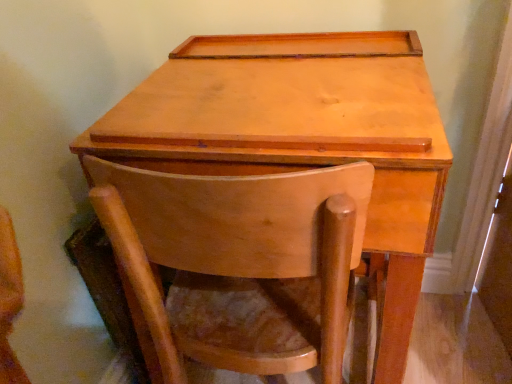
At what (x,y) coordinates should I click in order to perform the action: click on matte wood chair at center. Please return your answer as a coordinate pair (x, y). The width and height of the screenshot is (512, 384). Looking at the image, I should click on (239, 263).

Describe the element at coordinates (239, 263) in the screenshot. I see `matte wood chair at center` at that location.

This screenshot has height=384, width=512. What are the coordinates of `light brown wood table at center` in the screenshot? It's located at (303, 137).

The image size is (512, 384). What do you see at coordinates (303, 137) in the screenshot?
I see `light brown wood table at center` at bounding box center [303, 137].

Identify the location of matte wood chair at center. The image size is (512, 384). click(239, 263).

Which object is positioned more to the left, matte wood chair at center or light brown wood table at center?

From the viewer's perspective, matte wood chair at center appears more on the left side.

Is matte wood chair at center positioned in front of light brown wood table at center?

Yes, matte wood chair at center is closer to the camera.

Is point (145, 207) farther from viewer compared to point (395, 122)?

That is False.

From the image's perspective, is matte wood chair at center on top of light brown wood table at center?

No, from the image's perspective, matte wood chair at center is not on top of light brown wood table at center.

From a real-world perspective, is matte wood chair at center on top of light brown wood table at center?

Incorrect, from a real-world perspective, matte wood chair at center is lower than light brown wood table at center.

Is matte wood chair at center wider or thinner than light brown wood table at center?

In the image, matte wood chair at center appears to be more narrow than light brown wood table at center.

Is matte wood chair at center taller than light brown wood table at center?

No, matte wood chair at center is not taller than light brown wood table at center.

Consider the image. Can you confirm if matte wood chair at center is smaller than light brown wood table at center?

Indeed, matte wood chair at center has a smaller size compared to light brown wood table at center.

Is light brown wood table at center inside matte wood chair at center?

→ Indeed, light brown wood table at center is located within matte wood chair at center.

Are matte wood chair at center and light brown wood table at center far apart?

matte wood chair at center is near light brown wood table at center, not far away.

Is matte wood chair at center turned away from light brown wood table at center?

Yes, light brown wood table at center is at the back of matte wood chair at center.

Can you tell me how much matte wood chair at center and light brown wood table at center differ in facing direction?

Result: They differ by 178 degrees in their facing directions.

How distant is matte wood chair at center from light brown wood table at center?

matte wood chair at center is 7.12 inches away from light brown wood table at center.

In the image, there is a light brown wood table at center. Identify the location of chair below it (from the image's perspective). The width and height of the screenshot is (512, 384). (239, 263).

Can you confirm if light brown wood table at center is positioned to the left of matte wood chair at center?

No.

Does light brown wood table at center lie in front of matte wood chair at center?

No, light brown wood table at center is further to the viewer.

Which is less distant, (287, 119) or (243, 276)?

The point (287, 119) is closer to the camera.

From the image's perspective, is light brown wood table at center above or below matte wood chair at center?

Clearly, from the image's perspective, light brown wood table at center is above matte wood chair at center.

Consider the image. From a real-world perspective, relative to matte wood chair at center, is light brown wood table at center vertically above or below?

In terms of real-world spatial position, light brown wood table at center is above matte wood chair at center.

Based on the photo, which of these two, light brown wood table at center or matte wood chair at center, is thinner?

matte wood chair at center is thinner.

From their relative heights in the image, would you say light brown wood table at center is taller or shorter than matte wood chair at center?

Considering their sizes, light brown wood table at center has more height than matte wood chair at center.

Is light brown wood table at center smaller than matte wood chair at center?

Actually, light brown wood table at center might be larger than matte wood chair at center.

Is matte wood chair at center surrounded by light brown wood table at center?

Yes, matte wood chair at center is a part of light brown wood table at center.

Is light brown wood table at center far away from matte wood chair at center?

No.

Is light brown wood table at center facing away from matte wood chair at center?

Yes, light brown wood table at center is positioned with its back facing matte wood chair at center.

How many degrees apart are the facing directions of light brown wood table at center and matte wood chair at center?

There is a 178-degree angle between the facing directions of light brown wood table at center and matte wood chair at center.

Locate an element on the screen. This screenshot has height=384, width=512. table above the matte wood chair at center (from the image's perspective) is located at coordinates (303, 137).

Where is `chair located in front of the light brown wood table at center`? This screenshot has height=384, width=512. chair located in front of the light brown wood table at center is located at coordinates (239, 263).

Locate an element on the screen. The width and height of the screenshot is (512, 384). table lying above the matte wood chair at center (from the image's perspective) is located at coordinates (303, 137).